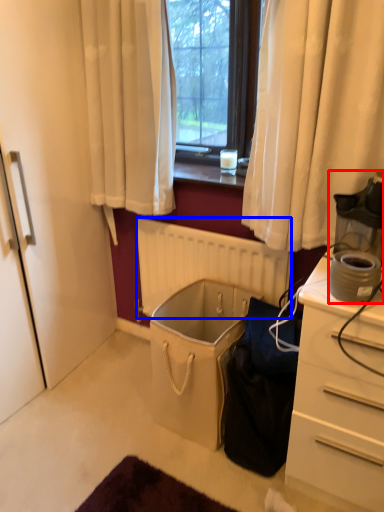
Question: Which object is closer to the camera taking this photo, appliance (highlighted by a red box) or radiator (highlighted by a blue box)?

Choices:
 (A) appliance
 (B) radiator

Answer: (A)